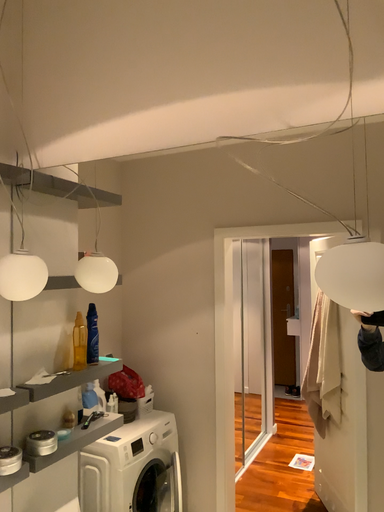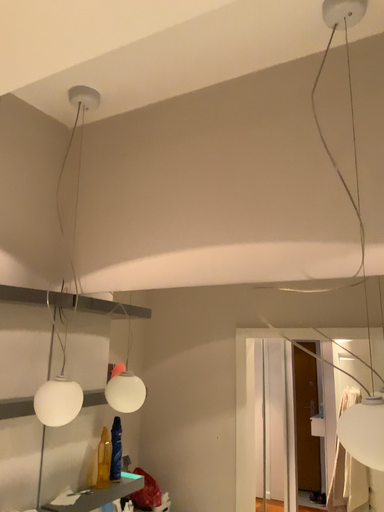
Question: How did the camera likely rotate when shooting the video?

Choices:
 (A) rotated upward
 (B) rotated downward

Answer: (A)